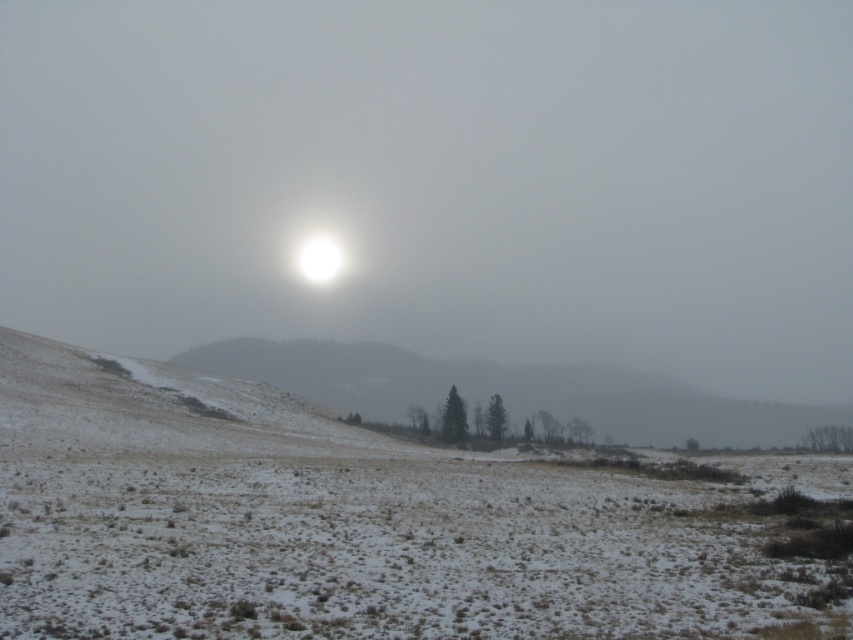
Is white snow-covered field at center taller than snowy grassy hill at center?

In fact, white snow-covered field at center may be shorter than snowy grassy hill at center.

Identify the location of white snow-covered field at center. The height and width of the screenshot is (640, 853). (372, 524).

Where is `white snow-covered field at center`? white snow-covered field at center is located at coordinates (372, 524).